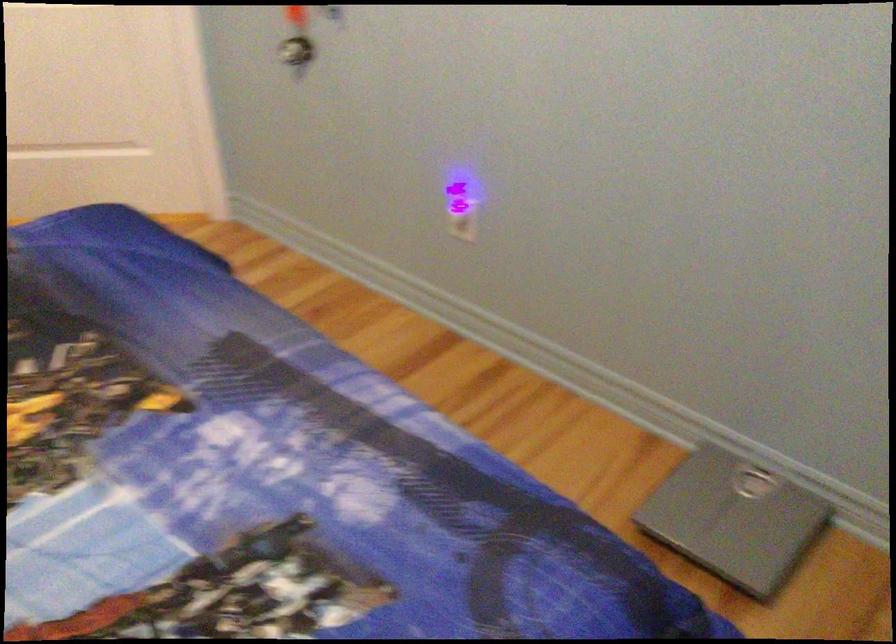
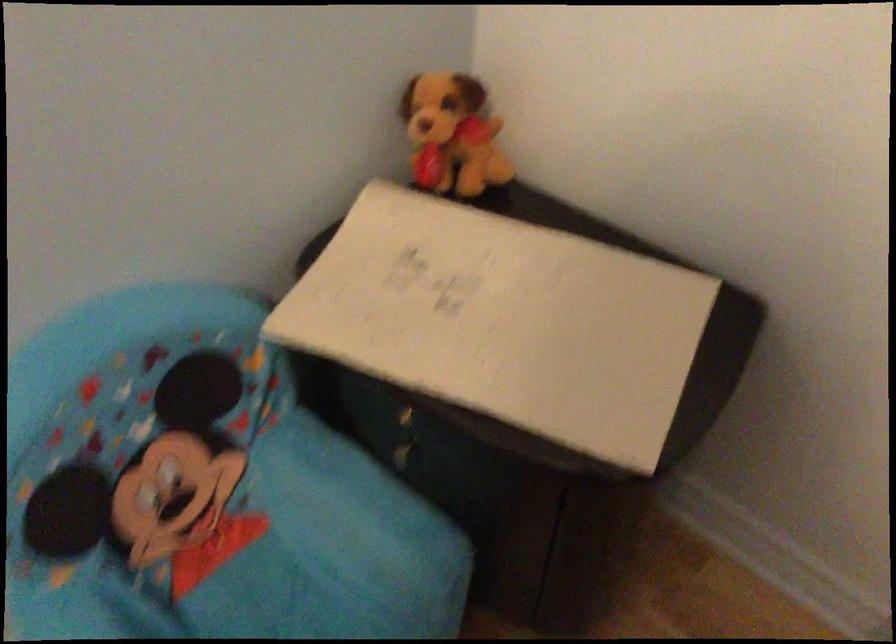
The images are taken continuously from a first-person perspective. In which direction is your viewpoint rotating?

The rotation direction of the camera is right-down.